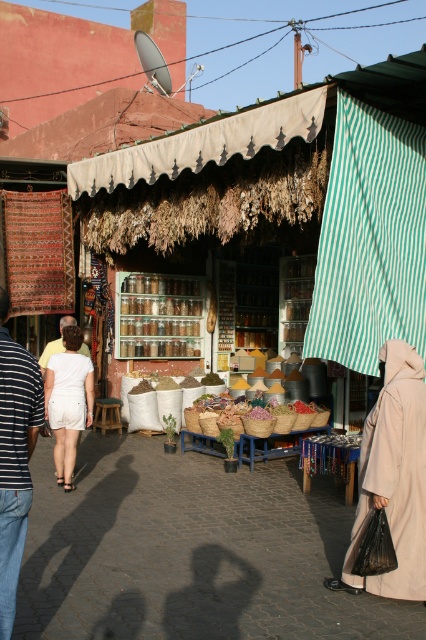
Who is positioned more to the right, blue striped shirt at left or light brown leather jacket at center?

blue striped shirt at left is more to the right.

This screenshot has width=426, height=640. What do you see at coordinates (14, 458) in the screenshot?
I see `blue striped shirt at left` at bounding box center [14, 458].

Identify the location of blue striped shirt at left. This screenshot has height=640, width=426. coord(14,458).

Between blue striped shirt at left and white cotton shorts at center, which one is positioned higher?

Positioned higher is blue striped shirt at left.

Between blue striped shirt at left and white cotton shorts at center, which one appears on the right side from the viewer's perspective?

Positioned to the right is blue striped shirt at left.

Is point (16, 412) farther from viewer compared to point (85, 384)?

No, (16, 412) is in front of (85, 384).

Locate an element on the screen. This screenshot has width=426, height=640. blue striped shirt at left is located at coordinates (14, 458).

Does white cotton shorts at center have a smaller size compared to light brown leather jacket at center?

Incorrect, white cotton shorts at center is not smaller in size than light brown leather jacket at center.

Is white cotton shorts at center bigger than light brown leather jacket at center?

Correct, white cotton shorts at center is larger in size than light brown leather jacket at center.

Does point (83, 387) lie behind point (52, 352)?

No, (83, 387) is in front of (52, 352).

I want to click on white cotton shorts at center, so click(x=68, y=401).